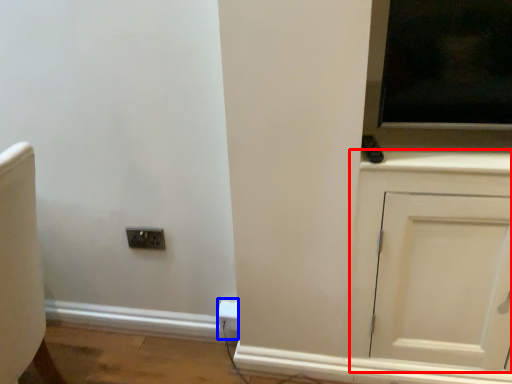
Question: Which object appears closest to the camera in this image, cabinetry (highlighted by a red box) or electric outlet (highlighted by a blue box)?

Choices:
 (A) cabinetry
 (B) electric outlet

Answer: (A)